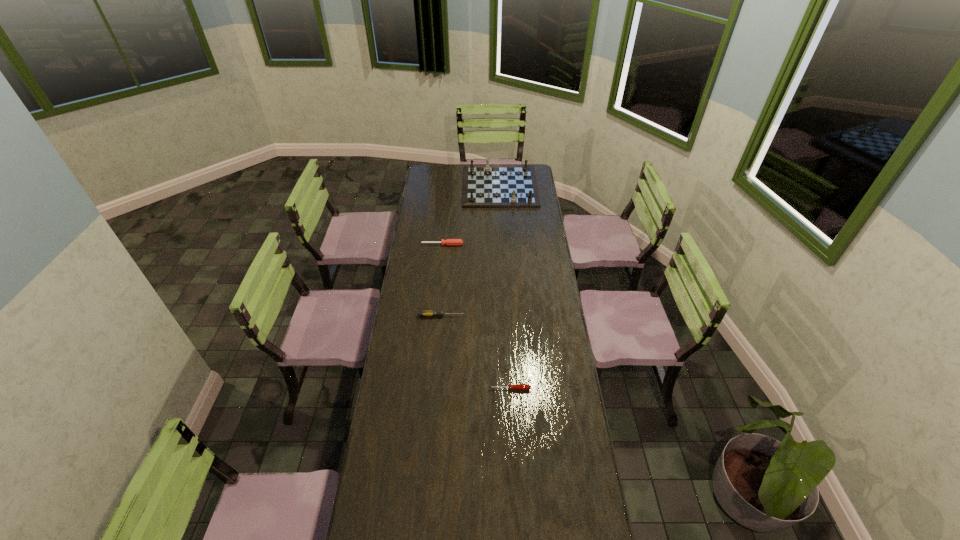
You are a GUI agent. You are given a task and a screenshot of the screen. Output one action in this format:
    pyautogui.click(x=<x>, y=<y>)
    Task: Click on the screwdriver that can be found as the closest to the farthest screwdriver
    This screenshot has height=540, width=960.
    Given the screenshot: What is the action you would take?
    pyautogui.click(x=422, y=313)

Where is `vacant region that satisfies the following two spatial constraints: 1. on the front side of the second farthest object; 2. on the left side of the nearest screwdriver`? vacant region that satisfies the following two spatial constraints: 1. on the front side of the second farthest object; 2. on the left side of the nearest screwdriver is located at coordinates (429, 389).

Identify the location of vacant space that satisfies the following two spatial constraints: 1. insert the third farthest object into a screw head; 2. on the left side of the nearest object. The image size is (960, 540). (436, 389).